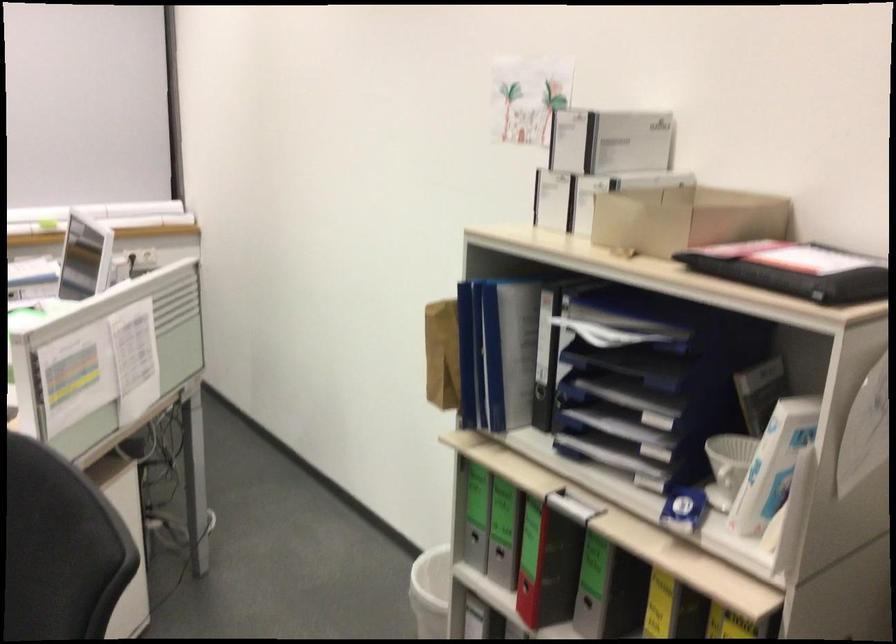
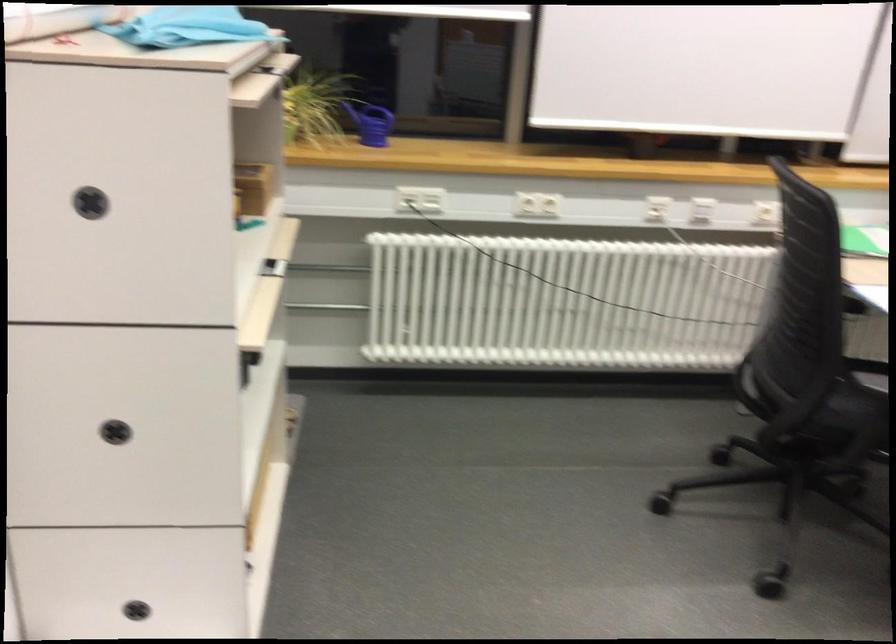
Question: Which direction would the cameraman need to move to produce the second image? Reply with the corresponding letter.

Choices:
 (A) Left
 (B) Right
 (C) Forward
 (D) Backward

Answer: (A)